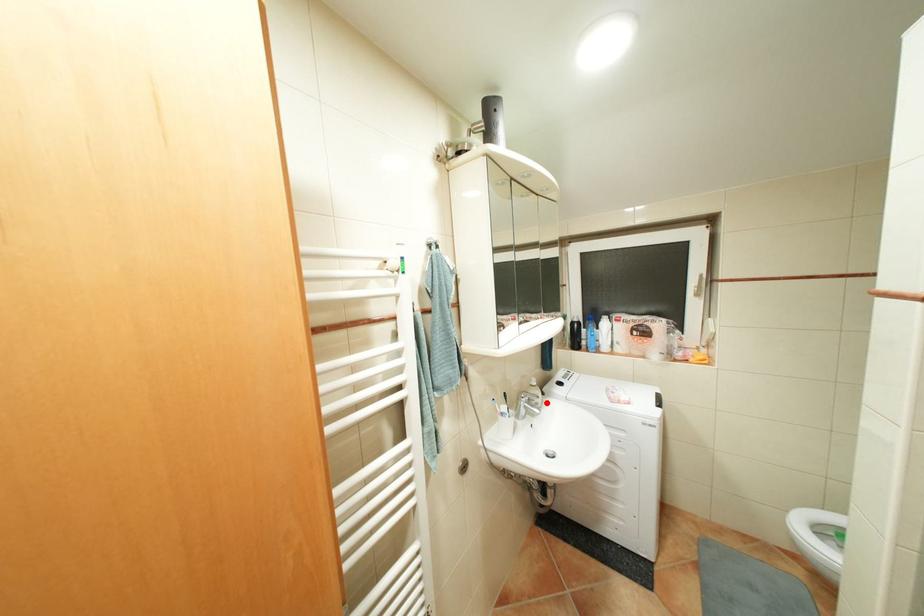
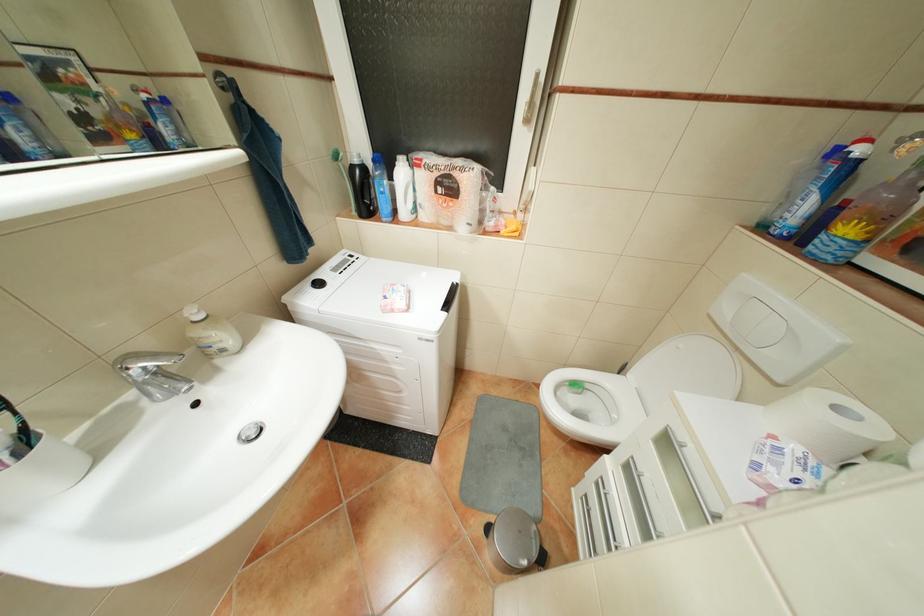
Question: I am providing you with two images of the same scene from different viewpoints. Given a red point in image1, look at the same physical point in image2. Is it:

Choices:
 (A) Closer to the viewpoint
 (B) Farther from the viewpoint

Answer: (A)